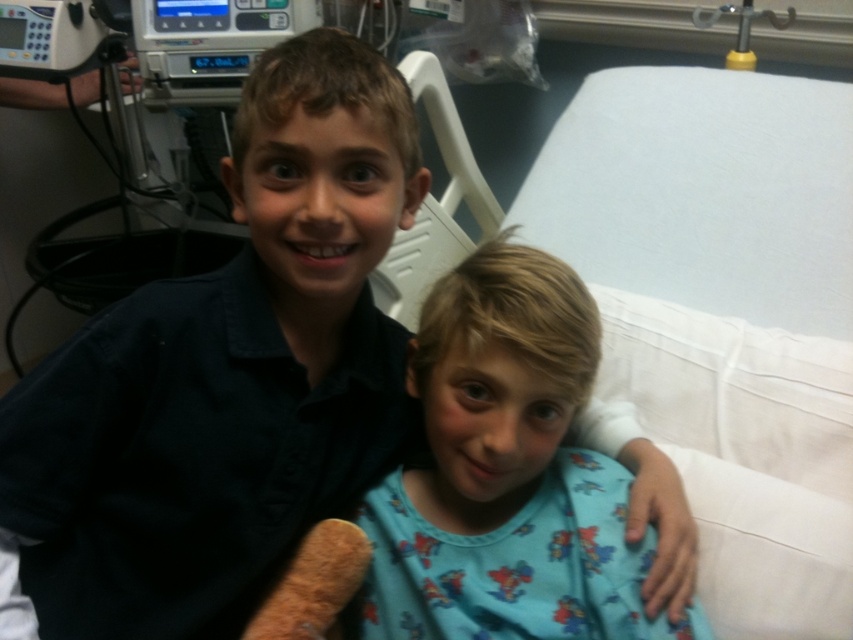
Question: Is white fabric bed at center smaller than blue cotton shirt at center?

Choices:
 (A) no
 (B) yes

Answer: (A)

Question: Is white fabric bed at center to the right of blue cotton shirt at center from the viewer's perspective?

Choices:
 (A) no
 (B) yes

Answer: (B)

Question: Can you confirm if white fabric bed at center is positioned below blue cotton shirt at center?

Choices:
 (A) no
 (B) yes

Answer: (A)